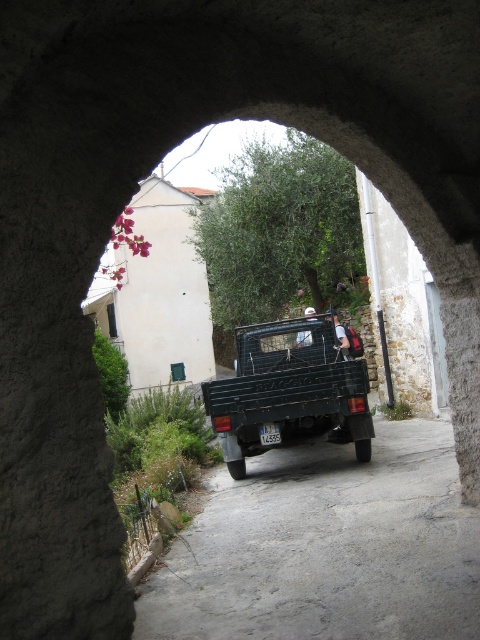
Question: Which point is farther to the camera?

Choices:
 (A) green matte truck at center
 (B) dark gray asphalt road at center

Answer: (A)

Question: Which point appears closest to the camera in this image?

Choices:
 (A) (297, 380)
 (B) (309, 614)

Answer: (B)

Question: Does dark gray asphalt road at center appear on the right side of green matte truck at center?

Choices:
 (A) no
 (B) yes

Answer: (A)

Question: Is the position of dark gray asphalt road at center less distant than that of green matte truck at center?

Choices:
 (A) yes
 (B) no

Answer: (A)

Question: From the image, what is the correct spatial relationship of dark gray asphalt road at center in relation to green matte truck at center?

Choices:
 (A) right
 (B) left

Answer: (B)